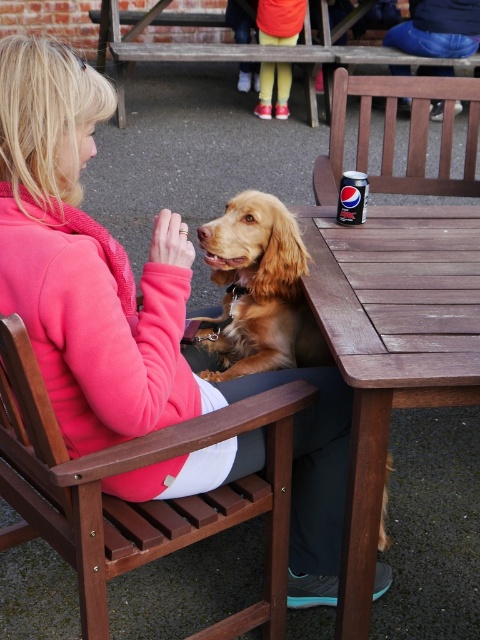
In the scene shown: You are a photographer trying to capture the golden brown fur at center and the brown wooden table at center in a single shot. Can you position yourself so that both are visible without moving any objects?

The brown wooden table at center is positioned under the golden brown fur at center, so yes, you can position yourself to see both the brown wooden table at center and the golden brown fur at center in the same shot since the fur is above the table.

You are trying to place a large plate on the brown wooden table at center. Considering the golden brown fur at center is already on the table, will there be enough space for the plate?

The brown wooden table at center might be wider than golden brown fur at center, so there could be enough space for the plate depending on the table size and the fur placement.